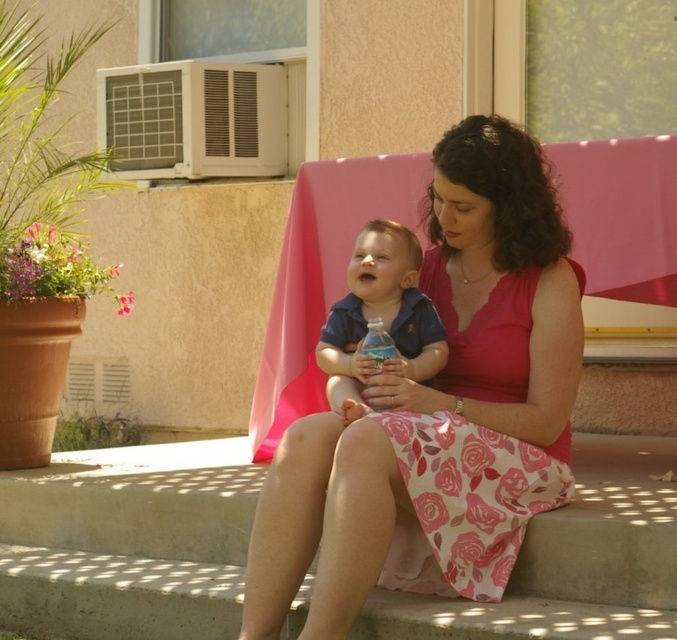
You are a photographer trying to capture the baby in the blue short sleeved shirt at center. The camera you are using has a focus point at point (378,317). Will this focus point be on the baby?

The point (378,317) is on the matte blue shirt at center, so yes, the focus point is on the baby.

You are standing in the outdoor scene and notice the pink fabric skirt at lower center. Where exactly is it positioned in relation to the other objects in the image?

The pink fabric skirt at lower center is located at point coordinates of (x=129, y=541).

You are a photographer trying to capture the baby in the center. To avoid covering the baby, should you adjust your camera to focus above or below the pink fabric skirt at lower center and matte blue shirt at center?

The pink fabric skirt at lower center is positioned under the matte blue shirt at center, so to avoid covering the baby, you should focus above the pink fabric skirt at lower center and matte blue shirt at center.